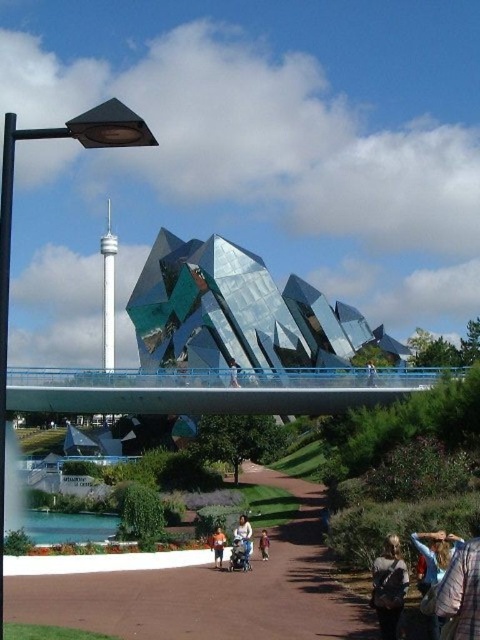
Question: Does black metal lamp post at left have a greater width compared to matte black jacket at lower right?

Choices:
 (A) no
 (B) yes

Answer: (B)

Question: Which of the following is the farthest from the observer?

Choices:
 (A) shiny glass sculpture at center
 (B) orange fabric shirt at center

Answer: (A)

Question: Can you confirm if blue glass pedestrian bridge at center is positioned to the left of white cotton shirt at center?

Choices:
 (A) no
 (B) yes

Answer: (A)

Question: Which object appears closest to the camera in this image?

Choices:
 (A) shiny glass sculpture at center
 (B) matte black jacket at lower right
 (C) orange fabric shirt at center

Answer: (B)

Question: Is blue glass pedestrian bridge at center thinner than matte black jacket at center?

Choices:
 (A) yes
 (B) no

Answer: (B)

Question: Estimate the real-world distances between objects in this image. Which object is closer to the light brown leather jacket at lower center?

Choices:
 (A) white cotton shirt at center
 (B) blue glass pedestrian bridge at center

Answer: (A)